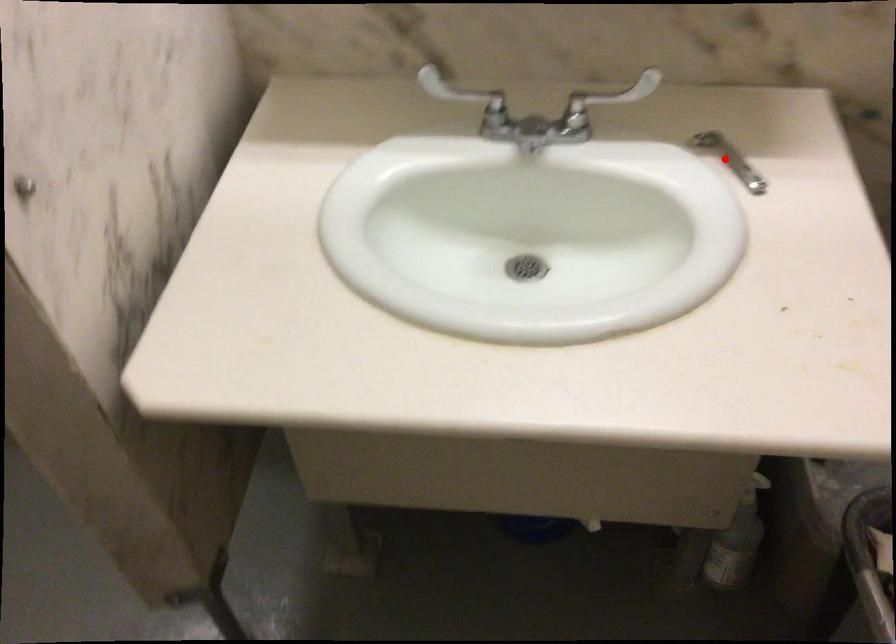
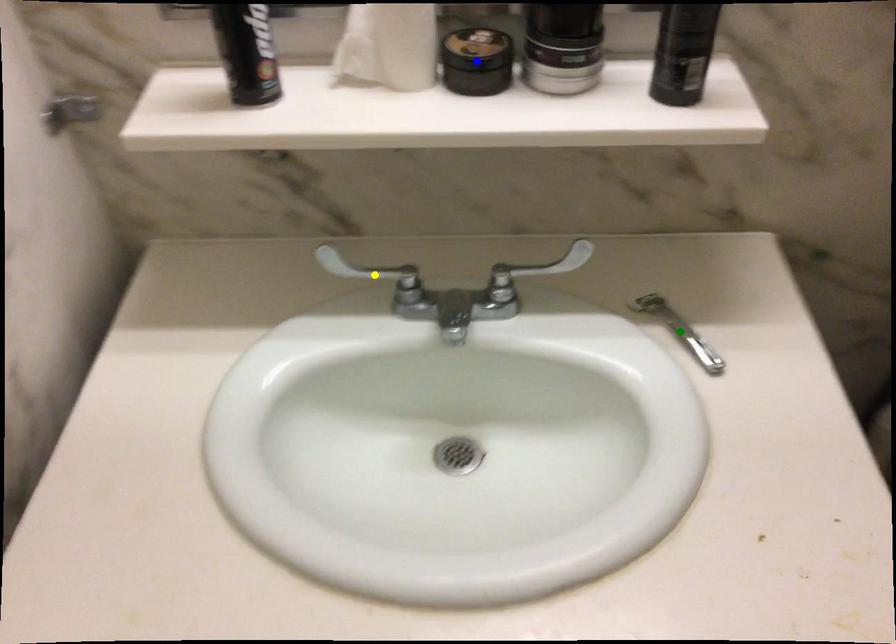
Question: I am providing you with two images of the same scene from different viewpoints. A red point is marked on the first image. You are given multiple points on the second image. Which point in image 2 is actually the same real-world point as the red point in image 1?

Choices:
 (A) yellow point
 (B) green point
 (C) blue point

Answer: (B)